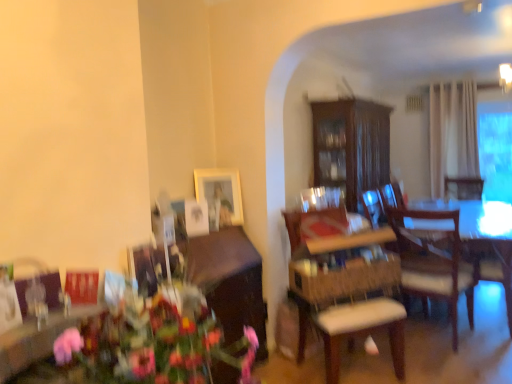
Question: Could you tell me if wooden armchair at right is facing wooden cabinet at lower left, which appears as the second cabinetry when viewed from the back?

Choices:
 (A) yes
 (B) no

Answer: (B)

Question: Can you confirm if wooden armchair at right is positioned to the right of wooden cabinet at lower left, the 2th cabinetry in the right-to-left sequence?

Choices:
 (A) yes
 (B) no

Answer: (A)

Question: Can you confirm if wooden armchair at right is positioned to the left of wooden cabinet at lower left, the 2th cabinetry in the right-to-left sequence?

Choices:
 (A) no
 (B) yes

Answer: (A)

Question: Does wooden armchair at right have a greater width compared to wooden cabinet at lower left, the 2th cabinetry in the right-to-left sequence?

Choices:
 (A) yes
 (B) no

Answer: (A)

Question: Would you say wooden cabinet at lower left, which is counted as the 1th cabinetry, starting from the front, is part of wooden armchair at right's contents?

Choices:
 (A) no
 (B) yes

Answer: (A)

Question: Choose the correct answer: Is wooden cabinet at lower left, which appears as the second cabinetry when viewed from the back, inside dark wood cabinet at center, positioned as the first cabinetry in right-to-left order, or outside it?

Choices:
 (A) inside
 (B) outside

Answer: (B)

Question: Is point (242, 264) positioned closer to the camera than point (326, 105)?

Choices:
 (A) farther
 (B) closer

Answer: (B)

Question: In terms of size, does wooden cabinet at lower left, marked as the 1th cabinetry in a left-to-right arrangement, appear bigger or smaller than dark wood cabinet at center, which is counted as the first cabinetry, starting from the top?

Choices:
 (A) small
 (B) big

Answer: (A)

Question: Considering the relative positions of wooden cabinet at lower left, the 1th cabinetry when ordered from bottom to top, and dark wood cabinet at center, the second cabinetry positioned from the front, in the image provided, is wooden cabinet at lower left, the 1th cabinetry when ordered from bottom to top, to the left or to the right of dark wood cabinet at center, the second cabinetry positioned from the front,?

Choices:
 (A) left
 (B) right

Answer: (A)

Question: From a real-world perspective, relative to wooden chair at center, which appears as the second chair when ordered from the bottom, is matte wooden picture frame at upper center vertically above or below?

Choices:
 (A) above
 (B) below

Answer: (A)

Question: Considering the relative positions of matte wooden picture frame at upper center and wooden chair at center, which appears as the second chair when ordered from the bottom, in the image provided, is matte wooden picture frame at upper center to the left or to the right of wooden chair at center, which appears as the second chair when ordered from the bottom,?

Choices:
 (A) right
 (B) left

Answer: (B)

Question: Considering the positions of matte wooden picture frame at upper center and wooden chair at center, placed as the first chair when sorted from top to bottom, in the image, is matte wooden picture frame at upper center bigger or smaller than wooden chair at center, placed as the first chair when sorted from top to bottom,?

Choices:
 (A) big
 (B) small

Answer: (B)

Question: Is point (216, 183) positioned closer to the camera than point (344, 228)?

Choices:
 (A) farther
 (B) closer

Answer: (A)

Question: Is wooden chair at center, placed as the first chair when sorted from top to bottom, inside or outside of transparent glass window at right?

Choices:
 (A) inside
 (B) outside

Answer: (B)

Question: From a real-world perspective, is wooden chair at center, placed as the first chair when sorted from top to bottom, above or below transparent glass window at right?

Choices:
 (A) above
 (B) below

Answer: (B)